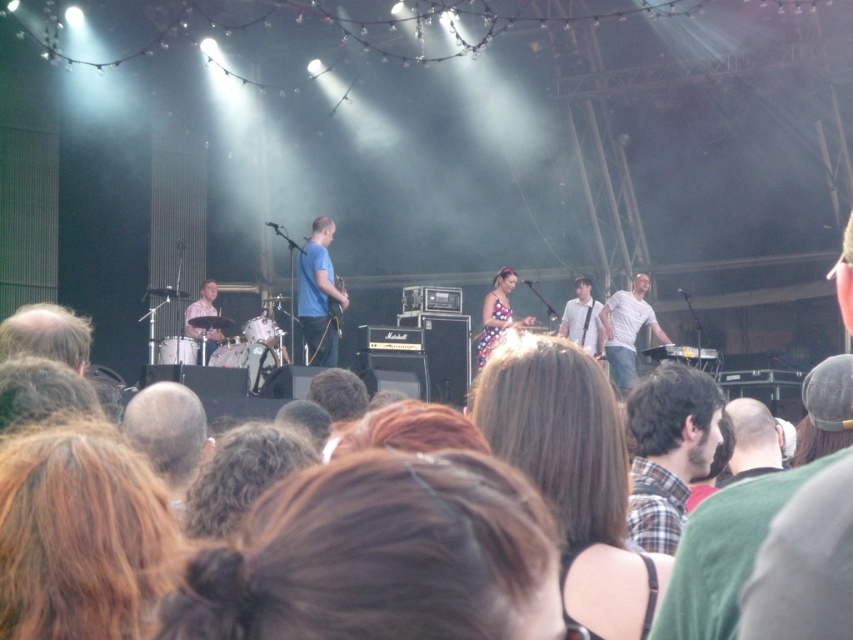
You are a photographer at the concert and want to capture a closeup of the drummer. You notice a person with blonde hair at lower left in your viewfinder. Where should you move your camera to focus on the drummer instead?

The drummer is located to the right of the blonde hair at lower left, so move the camera to the right to focus on the drummer.

You are a photographer at the concert. You want to take a photo of the brown hair at center and white shirt at center in the same frame. The camera you are using has a maximum focus range of 10 meters. Can you capture both subjects in focus?

The distance between brown hair at center and white shirt at center is 9.97 meters, which is within the camera focus range of 10 meters. Therefore, you can capture both subjects in focus.